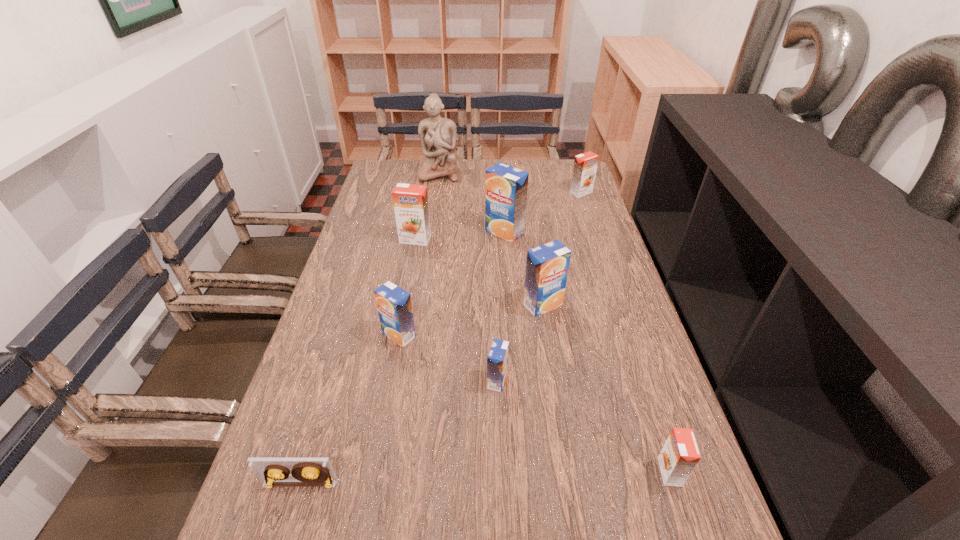
Where is `the farthest object`? The image size is (960, 540). the farthest object is located at coordinates (437, 135).

Image resolution: width=960 pixels, height=540 pixels. Find the location of `white figurine`. white figurine is located at coordinates (437, 135).

Image resolution: width=960 pixels, height=540 pixels. Find the location of `the biggest blue orange_juice`. the biggest blue orange_juice is located at coordinates (506, 186).

You are a GUI agent. You are given a task and a screenshot of the screen. Output one action in this format:
    pyautogui.click(x=<x>, y=<y>)
    Task: Click on the farthest blue orange_juice
    This screenshot has height=540, width=960.
    Given the screenshot: What is the action you would take?
    pyautogui.click(x=506, y=186)

At what (x,y) coordinates should I click in order to perform the action: click on the second biggest blue orange_juice. Please return your answer as a coordinate pair (x, y). The image size is (960, 540). Looking at the image, I should click on tap(547, 265).

Image resolution: width=960 pixels, height=540 pixels. I want to click on the fifth nearest object, so (x=547, y=265).

Find the location of a particular element. the biggest orange orange juice is located at coordinates (410, 201).

Find the location of a particular element. the leftmost orange orange juice is located at coordinates (410, 201).

The image size is (960, 540). Identify the location of the second farthest object. (585, 165).

Find the location of a particular element. The height and width of the screenshot is (540, 960). the farthest orange orange juice is located at coordinates (585, 165).